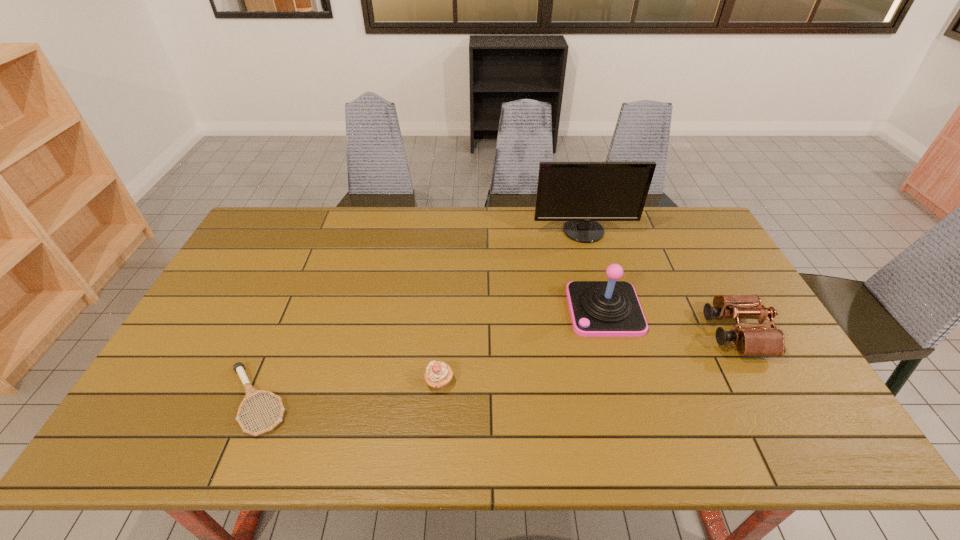
Where is `free space located forward from the base of the fourth shortest object`? The height and width of the screenshot is (540, 960). free space located forward from the base of the fourth shortest object is located at coordinates (446, 310).

Locate an element on the screen. This screenshot has width=960, height=540. vacant space situated 0.240m forward from the base of the fourth shortest object is located at coordinates (488, 310).

What are the coordinates of `vacant space located forward from the base of the fourth shortest object` in the screenshot? It's located at (494, 310).

The width and height of the screenshot is (960, 540). In order to click on free location located through the eyepieces of the rightmost object in this screenshot , I will do `click(601, 333)`.

At what (x,y) coordinates should I click in order to perform the action: click on free location located through the eyepieces of the rightmost object. Please return your answer as a coordinate pair (x, y). The image size is (960, 540). Looking at the image, I should click on (583, 333).

Identify the location of blank area located through the eyepieces of the rightmost object. (630, 333).

Where is `vacant region located on the right of the cupcake`? This screenshot has height=540, width=960. vacant region located on the right of the cupcake is located at coordinates (510, 382).

Locate an element on the screen. The height and width of the screenshot is (540, 960). free space located 0.370m on the back of the tennis racket is located at coordinates (311, 271).

At what (x,y) coordinates should I click in order to perform the action: click on object located at the far edge. Please return your answer as a coordinate pair (x, y). The height and width of the screenshot is (540, 960). Looking at the image, I should click on (581, 193).

Where is `object that is at the near edge`? Image resolution: width=960 pixels, height=540 pixels. object that is at the near edge is located at coordinates (250, 391).